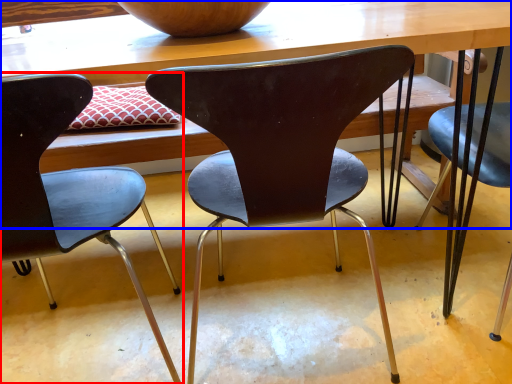
Question: Among these objects, which one is farthest to the camera, chair (highlighted by a red box) or table (highlighted by a blue box)?

Choices:
 (A) chair
 (B) table

Answer: (B)